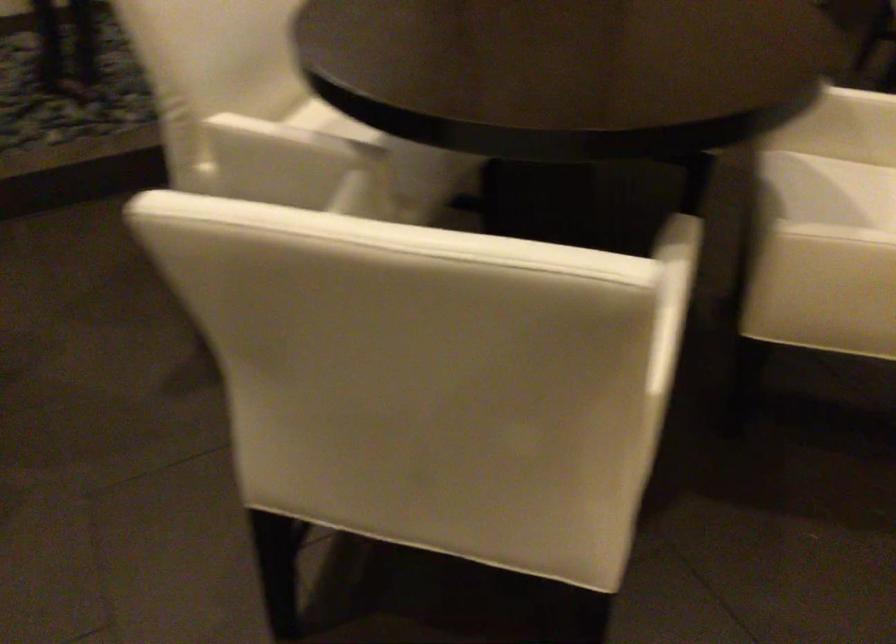
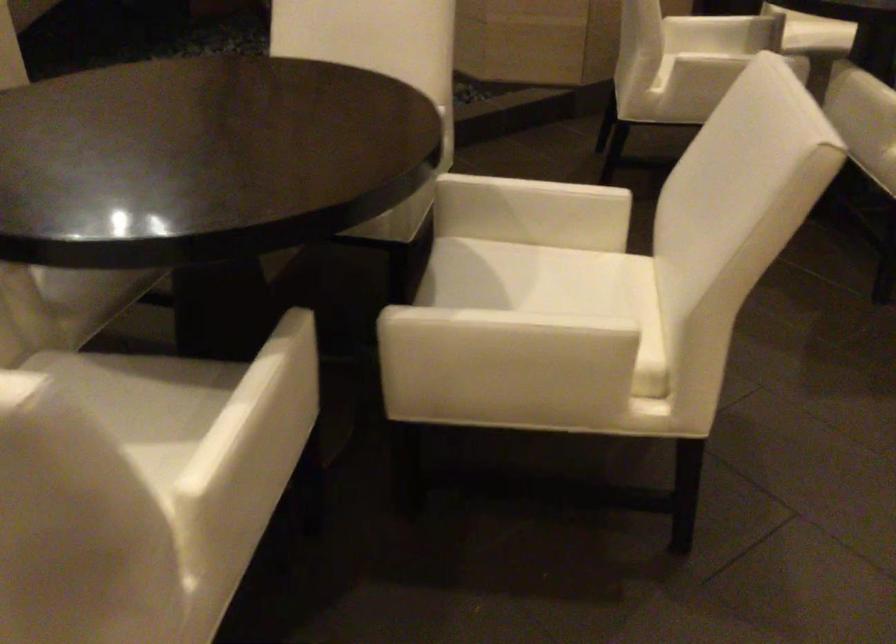
Where in the second image is the point corresponding to (681,323) from the first image?

(299, 413)